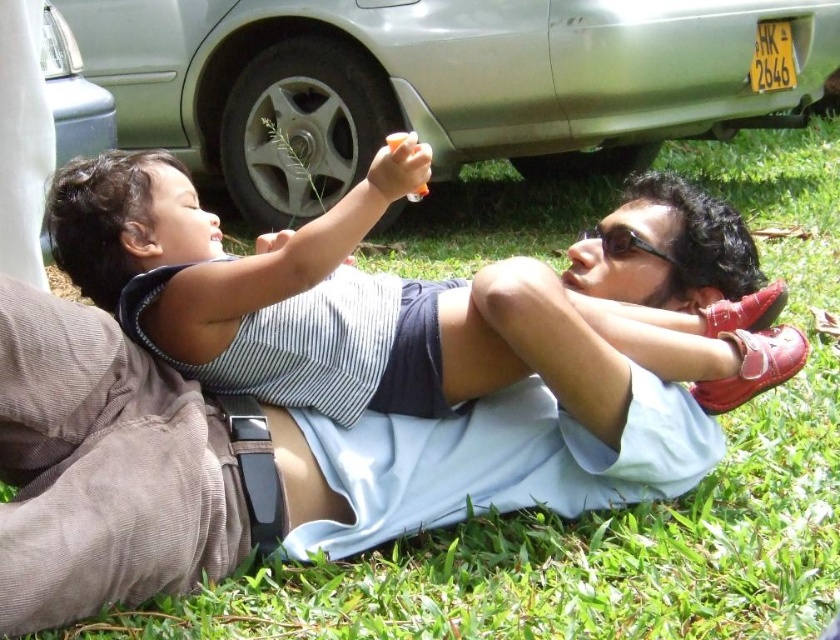
Question: Considering the real-world distances, which object is closest to the silver metallic car at upper center?

Choices:
 (A) black plastic goggles at upper center
 (B) striped fabric shirt at upper center

Answer: (B)

Question: Is silver metallic car at upper left to the left of orange plastic bottle at center from the viewer's perspective?

Choices:
 (A) no
 (B) yes

Answer: (B)

Question: Is silver metallic car at upper center closer to camera compared to silver metallic car at upper left?

Choices:
 (A) yes
 (B) no

Answer: (B)

Question: Which object appears farthest from the camera in this image?

Choices:
 (A) silver metallic car at upper left
 (B) blue fabric shirt at center
 (C) black plastic goggles at upper center

Answer: (A)

Question: Does blue fabric shirt at center have a lesser width compared to silver metallic car at upper center?

Choices:
 (A) yes
 (B) no

Answer: (A)

Question: Which point is closer to the camera?

Choices:
 (A) (202, 38)
 (B) (699, 365)
 (C) (413, 196)

Answer: (C)